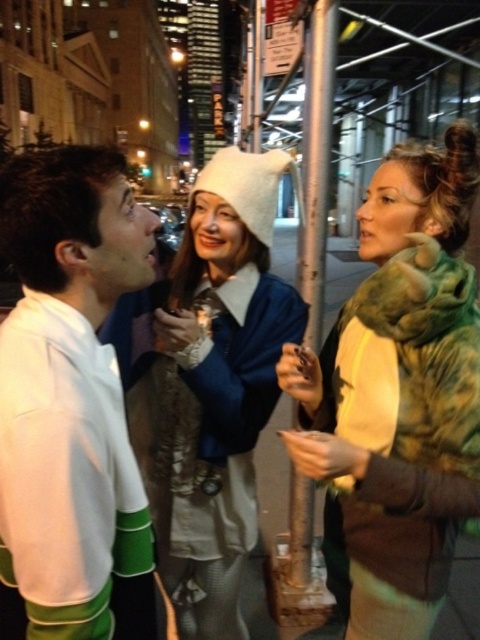
How much distance is there between green fur coat at right and white fabric shirt at left?

A distance of 19.32 inches exists between green fur coat at right and white fabric shirt at left.

Is green fur coat at right to the right of white fabric shirt at left from the viewer's perspective?

Correct, you'll find green fur coat at right to the right of white fabric shirt at left.

Locate an element on the screen. The height and width of the screenshot is (640, 480). green fur coat at right is located at coordinates (397, 394).

Who is positioned more to the left, green fur coat at right or white fuzzy hat at center?

From the viewer's perspective, white fuzzy hat at center appears more on the left side.

Can you confirm if green fur coat at right is positioned to the left of white fuzzy hat at center?

No, green fur coat at right is not to the left of white fuzzy hat at center.

At what (x,y) coordinates should I click in order to perform the action: click on green fur coat at right. Please return your answer as a coordinate pair (x, y). This screenshot has width=480, height=640. Looking at the image, I should click on (397, 394).

Is white fuzzy hat at center smaller than white fabric shirt at left?

Incorrect, white fuzzy hat at center is not smaller in size than white fabric shirt at left.

Is white fuzzy hat at center below white fabric shirt at left?

Yes.

The image size is (480, 640). What do you see at coordinates (208, 385) in the screenshot? I see `white fuzzy hat at center` at bounding box center [208, 385].

This screenshot has height=640, width=480. Identify the location of white fuzzy hat at center. (208, 385).